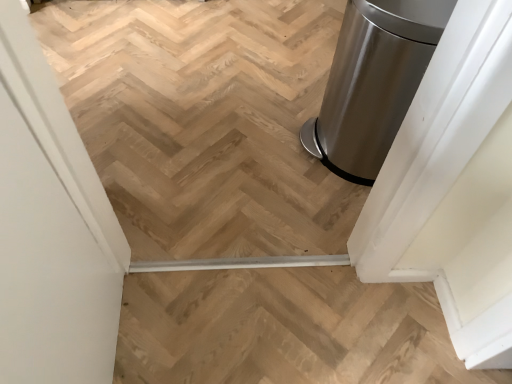
Question: Should I look upward or downward to see satin metallic trash can at right?

Choices:
 (A) down
 (B) up

Answer: (B)

Question: Can you confirm if satin metallic trash can at right is bigger than white matte screen door at left?

Choices:
 (A) no
 (B) yes

Answer: (A)

Question: Are satin metallic trash can at right and white matte screen door at left far apart?

Choices:
 (A) no
 (B) yes

Answer: (A)

Question: From the image's perspective, is satin metallic trash can at right beneath white matte screen door at left?

Choices:
 (A) yes
 (B) no

Answer: (B)

Question: Is the depth of satin metallic trash can at right greater than that of white matte screen door at left?

Choices:
 (A) no
 (B) yes

Answer: (B)

Question: Does satin metallic trash can at right appear on the left side of white matte screen door at left?

Choices:
 (A) no
 (B) yes

Answer: (A)

Question: Is satin metallic trash can at right wider than white matte screen door at left?

Choices:
 (A) yes
 (B) no

Answer: (A)

Question: Can satin metallic trash can at right be found inside natural wood stairs at center?

Choices:
 (A) no
 (B) yes

Answer: (A)

Question: Is the surface of natural wood stairs at center in direct contact with satin metallic trash can at right?

Choices:
 (A) no
 (B) yes

Answer: (A)

Question: Is natural wood stairs at center turned away from satin metallic trash can at right?

Choices:
 (A) no
 (B) yes

Answer: (A)

Question: Is the depth of natural wood stairs at center greater than that of satin metallic trash can at right?

Choices:
 (A) yes
 (B) no

Answer: (B)

Question: Considering the relative sizes of natural wood stairs at center and satin metallic trash can at right in the image provided, is natural wood stairs at center thinner than satin metallic trash can at right?

Choices:
 (A) yes
 (B) no

Answer: (A)

Question: From a real-world perspective, is natural wood stairs at center positioned under satin metallic trash can at right based on gravity?

Choices:
 (A) yes
 (B) no

Answer: (A)

Question: Is white matte screen door at left behind satin metallic trash can at right?

Choices:
 (A) yes
 (B) no

Answer: (B)